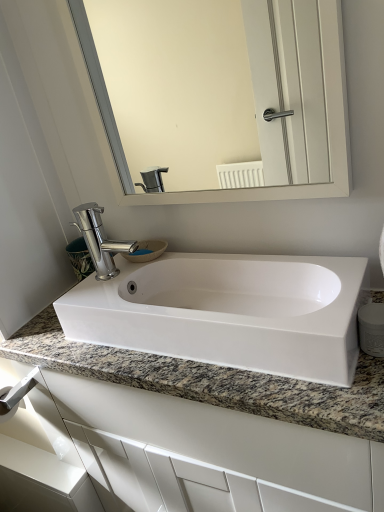
Question: In the image, is polished chrome faucet at center positioned in front of or behind white glossy sink at center?

Choices:
 (A) front
 (B) behind

Answer: (B)

Question: Considering the relative positions of polished chrome faucet at center and white glossy sink at center in the image provided, is polished chrome faucet at center to the left or to the right of white glossy sink at center?

Choices:
 (A) right
 (B) left

Answer: (B)

Question: Considering the real-world distances, which object is closest to the white glossy sink at center?

Choices:
 (A) white glossy mirror at upper center
 (B) granite at center
 (C) polished chrome faucet at center
 (D) satin nickel towel bar at lower left

Answer: (B)

Question: Which object is the farthest from the white glossy mirror at upper center?

Choices:
 (A) granite at center
 (B) white glossy sink at center
 (C) polished chrome faucet at center
 (D) satin nickel towel bar at lower left

Answer: (D)